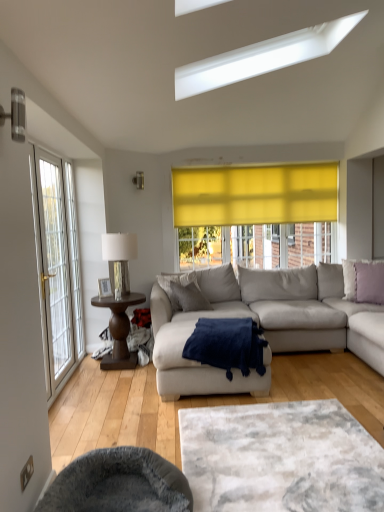
Question: From a real-world perspective, does white textured rug at center sit lower than white glass door at left?

Choices:
 (A) yes
 (B) no

Answer: (A)

Question: Considering the relative sizes of white textured rug at center and white glass door at left in the image provided, is white textured rug at center wider than white glass door at left?

Choices:
 (A) no
 (B) yes

Answer: (B)

Question: Does white textured rug at center have a smaller size compared to white glass door at left?

Choices:
 (A) yes
 (B) no

Answer: (A)

Question: Considering the relative sizes of white textured rug at center and white glass door at left in the image provided, is white textured rug at center bigger than white glass door at left?

Choices:
 (A) no
 (B) yes

Answer: (A)

Question: Considering the relative positions of white textured rug at center and white glass door at left in the image provided, is white textured rug at center to the left of white glass door at left from the viewer's perspective?

Choices:
 (A) no
 (B) yes

Answer: (A)

Question: In the image, is dark brown wooden side table at left on the left side or the right side of navy blue plush blanket at center?

Choices:
 (A) right
 (B) left

Answer: (B)

Question: In terms of width, does dark brown wooden side table at left look wider or thinner when compared to navy blue plush blanket at center?

Choices:
 (A) wide
 (B) thin

Answer: (B)

Question: Is dark brown wooden side table at left taller or shorter than navy blue plush blanket at center?

Choices:
 (A) tall
 (B) short

Answer: (A)

Question: Is dark brown wooden side table at left in front of or behind navy blue plush blanket at center in the image?

Choices:
 (A) behind
 (B) front

Answer: (A)

Question: Based on their positions, is metallic silver table lamp at left located to the left or right of lavender fabric pillow at right, the second pillow in the left-to-right sequence?

Choices:
 (A) right
 (B) left

Answer: (B)

Question: From the image's perspective, is metallic silver table lamp at left above or below lavender fabric pillow at right, which is the first pillow from right to left?

Choices:
 (A) above
 (B) below

Answer: (A)

Question: Would you say metallic silver table lamp at left is inside or outside lavender fabric pillow at right, which is the first pillow from right to left?

Choices:
 (A) inside
 (B) outside

Answer: (B)

Question: In terms of width, does metallic silver table lamp at left look wider or thinner when compared to lavender fabric pillow at right, which is the first pillow from right to left?

Choices:
 (A) wide
 (B) thin

Answer: (A)

Question: From the image's perspective, is white glass door at left above or below lavender fabric pillow at right, which is the first pillow from right to left?

Choices:
 (A) below
 (B) above

Answer: (B)

Question: Is white glass door at left inside or outside of lavender fabric pillow at right, the second pillow in the left-to-right sequence?

Choices:
 (A) inside
 (B) outside

Answer: (B)